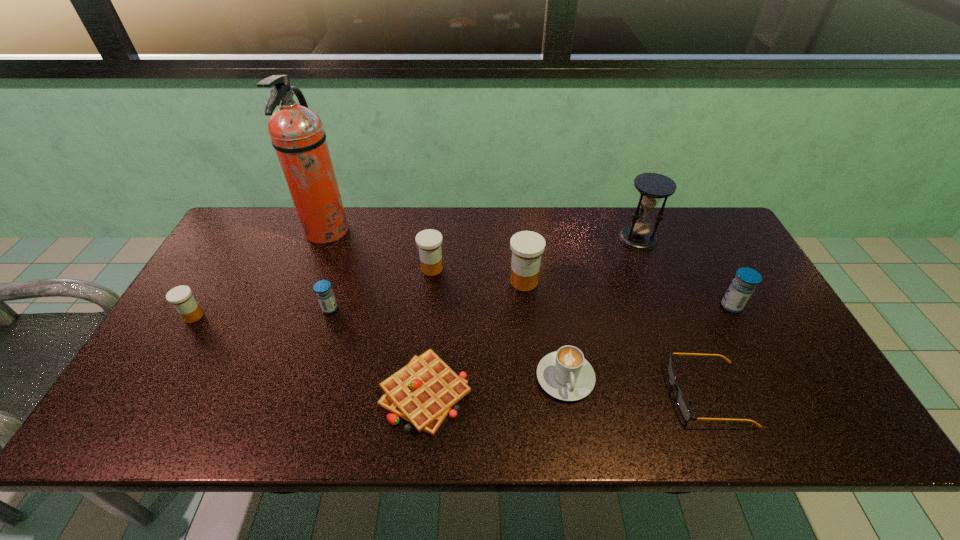
In order to click on free space between the left blue medicine and the waffle in this screenshot , I will do `click(378, 351)`.

Where is `blank region between the right blue medicine and the leftmost orange medicine`? The width and height of the screenshot is (960, 540). blank region between the right blue medicine and the leftmost orange medicine is located at coordinates (463, 311).

Where is `blank region between the cappuccino and the nearest orange medicine`? The height and width of the screenshot is (540, 960). blank region between the cappuccino and the nearest orange medicine is located at coordinates (379, 347).

The height and width of the screenshot is (540, 960). What are the coordinates of `empty space between the smaller blue medicine and the hourglass` in the screenshot? It's located at (484, 274).

Image resolution: width=960 pixels, height=540 pixels. I want to click on the sixth closest object to the cappuccino, so click(x=653, y=187).

Point out which object is positioned as the fifth nearest to the smallest orange medicine. Please provide its 2D coordinates. Your answer should be formatted as a tuple, i.e. [(x, y)], where the tuple contains the x and y coordinates of a point satisfying the conditions above.

[(527, 247)]

Identify which medicine is the third closest to the fourth medicine from right to left. Please provide its 2D coordinates. Your answer should be formatted as a tuple, i.e. [(x, y)], where the tuple contains the x and y coordinates of a point satisfying the conditions above.

[(527, 247)]

Select which medicine appears as the fourth closest to the cappuccino. Please provide its 2D coordinates. Your answer should be formatted as a tuple, i.e. [(x, y)], where the tuple contains the x and y coordinates of a point satisfying the conditions above.

[(322, 288)]

Locate an element on the screen. The image size is (960, 540). the third closest orange medicine to the spectacles is located at coordinates (181, 297).

Point out which orange medicine is positioned as the second nearest to the tallest medicine. Please provide its 2D coordinates. Your answer should be formatted as a tuple, i.e. [(x, y)], where the tuple contains the x and y coordinates of a point satisfying the conditions above.

[(181, 297)]